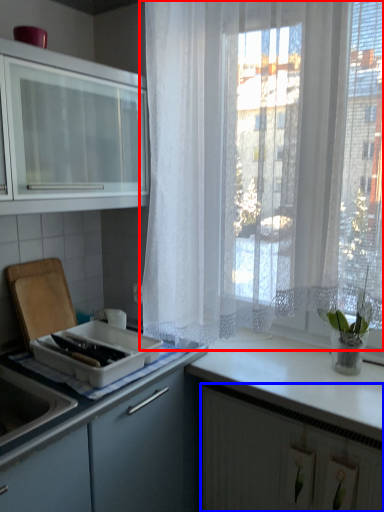
Question: Among these objects, which one is nearest to the camera, curtain (highlighted by a red box) or cabinetry (highlighted by a blue box)?

Choices:
 (A) curtain
 (B) cabinetry

Answer: (A)